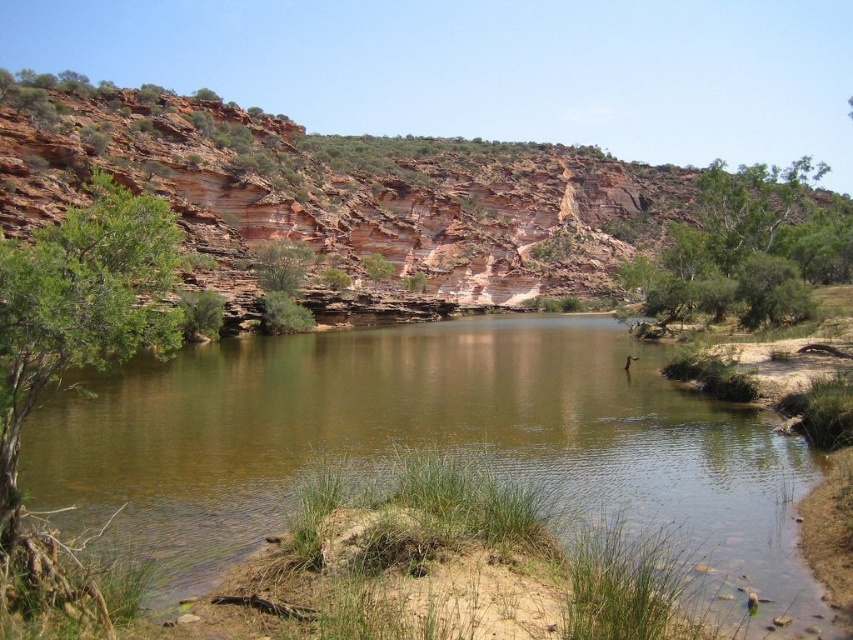
You are planning to set up a picnic area near the water. You want to choose a spot under the shade of the trees. Which tree would provide a larger shaded area, the green leafy tree at left or the green leafy tree at center?

The green leafy tree at left might be wider than green leafy tree at center, so it likely provides a larger shaded area.

You are an environmental researcher studying tree growth in arid regions. You observe two trees in the scene, the green leafy tree at left and the green leafy tree at upper center. Which tree has a narrower trunk?

The green leafy tree at left has a narrower trunk than the green leafy tree at upper center.

You are a hiker who wants to take a photo of the brown sedimentary rock at center and the green leafy tree at upper center. You have a camera with a 50mm lens. Can you fit both objects in the frame from your current position?

The brown sedimentary rock at center is 74.94 meters away from the green leafy tree at upper center. With a 50mm lens, which has a moderate field of view, it might be challenging to capture both objects in a single frame if they are positioned far apart. However, since the distance between them is about 75 meters, you may need to adjust your position closer or use a wider lens to ensure both are visible.